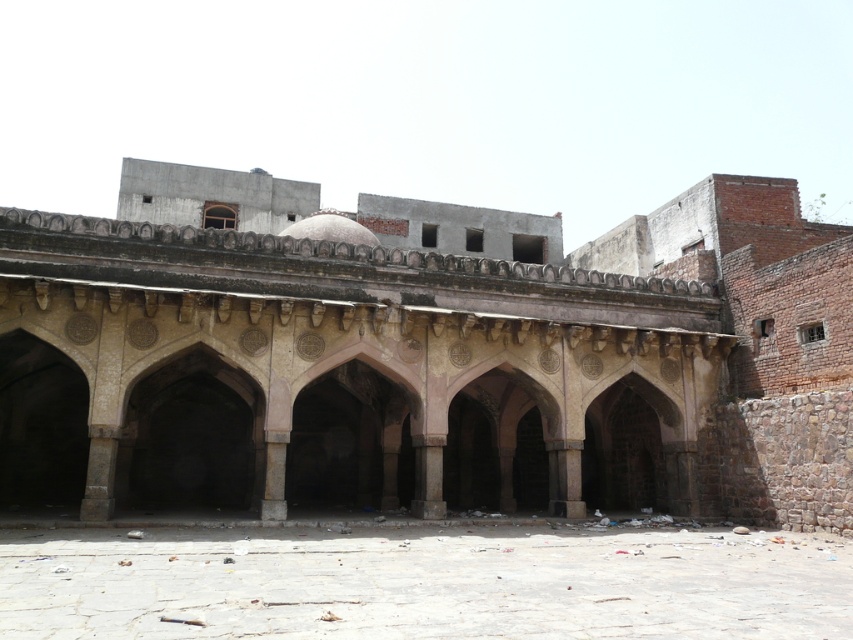
You are an architect examining the old building. You need to determine the spatial relationship between the stone archway at center and the stone paved courtyard at center. Which one is closer to you?

The stone archway at center is closer to you than the stone paved courtyard at center because it is further to the viewer.

You are standing in front of the old architectural structure and want to determine which of the two points, point (41,273) or point (720,568), is closer to you. Based on the structure, which point is nearer?

Point (41,273) is closer to you because it is further to the viewer than point (720,568).